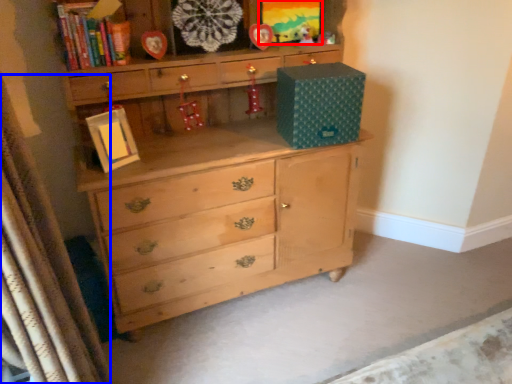
Question: Which of the following is the farthest to the observer, picture frame (highlighted by a red box) or curtain (highlighted by a blue box)?

Choices:
 (A) picture frame
 (B) curtain

Answer: (A)